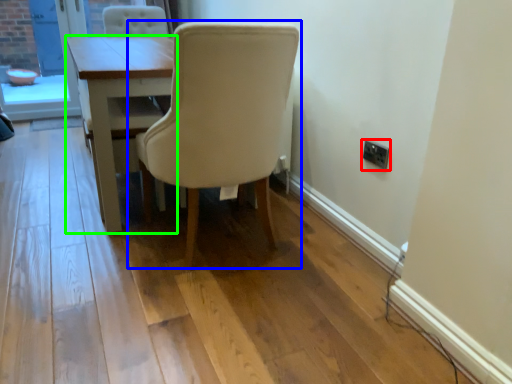
Question: Based on their relative distances, which object is nearer to electric outlet (highlighted by a red box)? Choose from chair (highlighted by a blue box) and table (highlighted by a green box).

Choices:
 (A) chair
 (B) table

Answer: (A)